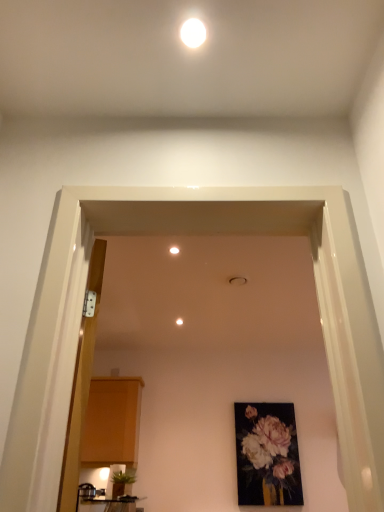
Question: From the image's perspective, relative to matte black table at lower left, is white matte ceiling light at center, which ranks as the second lighting in top-to-bottom order, above or below?

Choices:
 (A) below
 (B) above

Answer: (B)

Question: From a real-world perspective, is white matte ceiling light at center, the first lighting positioned from the left, physically located above or below matte black table at lower left?

Choices:
 (A) below
 (B) above

Answer: (B)

Question: Considering the real-world distances, which object is closest to the wooden door at left?

Choices:
 (A) white matte ceiling light at center, the 2th lighting positioned from the front
 (B) matte wood cabinet at left
 (C) matte floral painting at center
 (D) green leafy plant at lower left
 (E) white glossy light fixture at upper center, the second lighting from the back

Answer: (A)

Question: Which of these objects is positioned closest to the white glossy light fixture at upper center, the second lighting from the back?

Choices:
 (A) matte black table at lower left
 (B) green leafy plant at lower left
 (C) matte wood cabinet at left
 (D) wooden door at left
 (E) matte floral painting at center

Answer: (D)